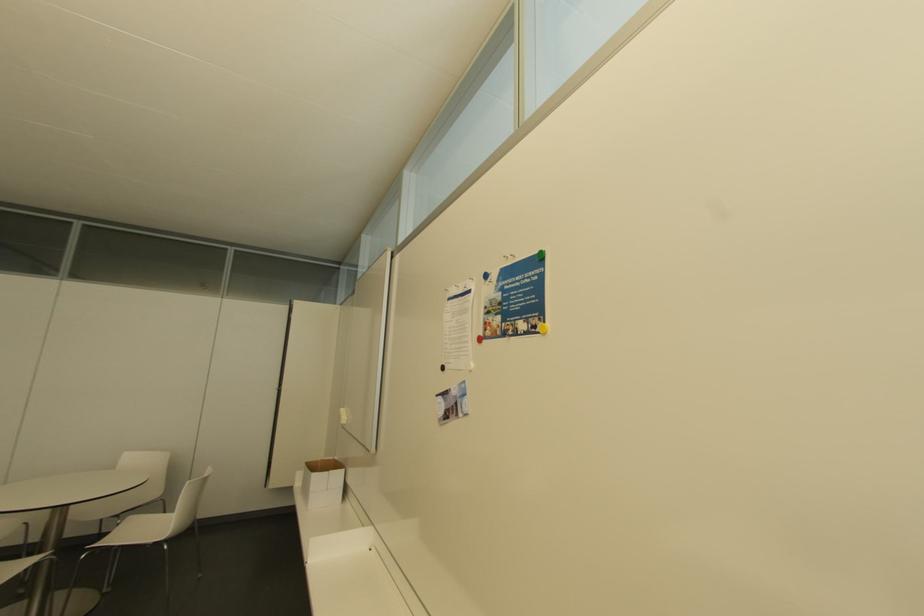
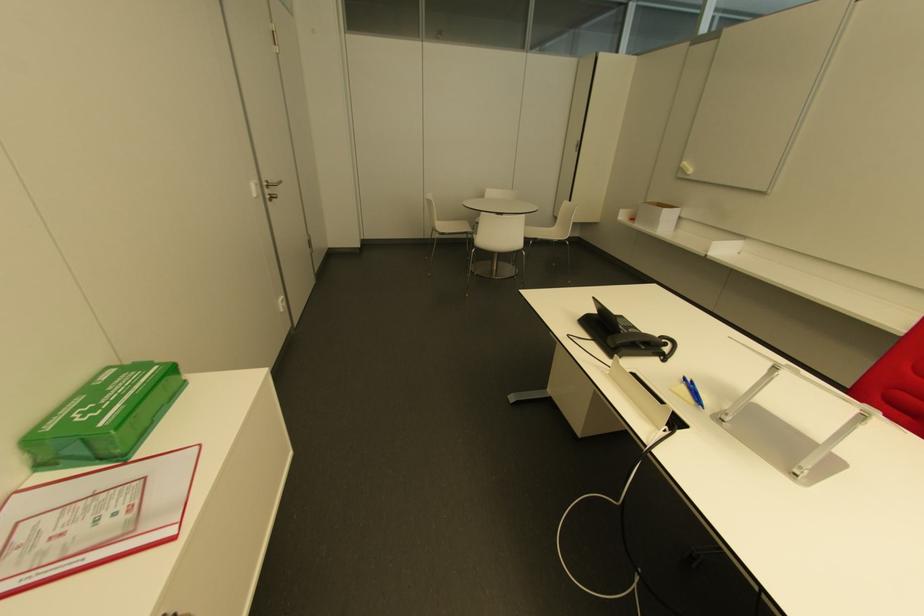
In the second image, find the point that corresponds to (165,541) in the first image.

(565, 240)